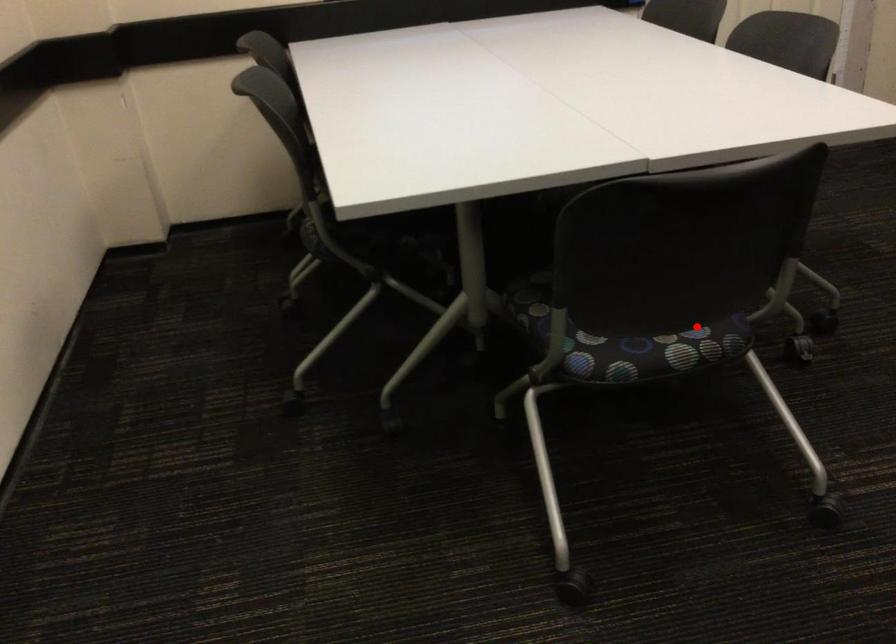
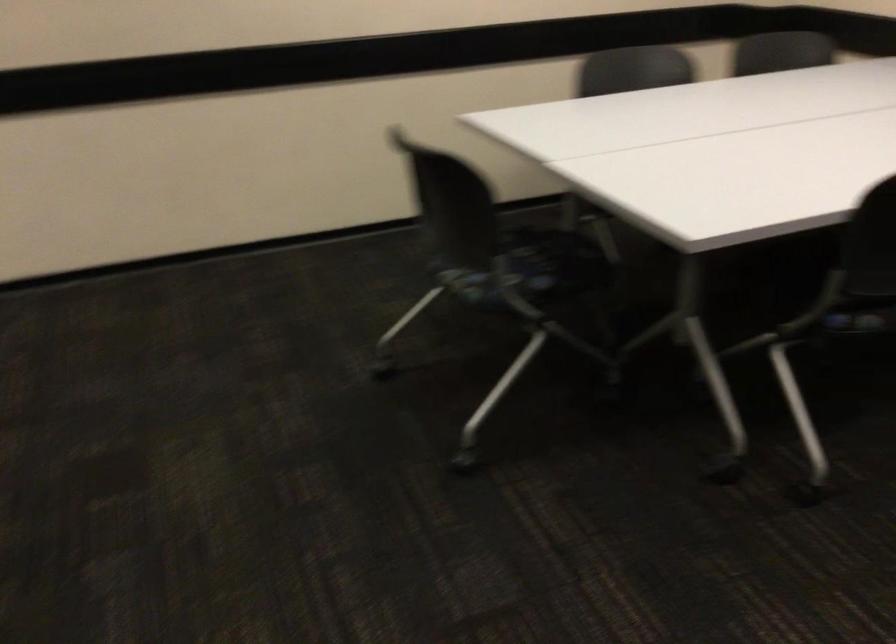
In the second image, find the point that corresponds to the highlighted location in the first image.

(494, 285)